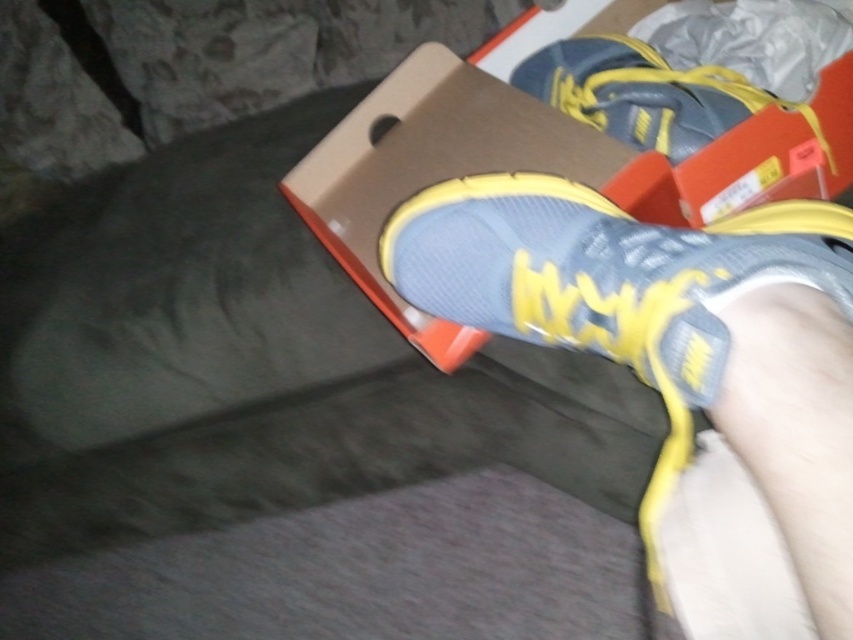
You are a delivery person who just arrived at a customer house. You need to place a package on a table that is 30 inches away from you. The package is currently at point point (390, 234). Do you need to move it forward or backward to reach the desired distance?

The point (390, 234) is currently 25.75 inches away from the camera. Since the desired distance is 30 inches, you need to move the package forward by 4.25 inches to reach the required distance.

From the picture: You are trying to organize your closet and want to place the matte cardboard shoebox at center and the matte blue shoe at center in a straight line. If you want the shoebox to be to the right of the shoe, is the current arrangement correct?

The matte cardboard shoebox at center is positioned on the right side of matte blue shoe at center, so the current arrangement already has the shoebox to the right of the shoe, making it correct for your desired straight line setup.